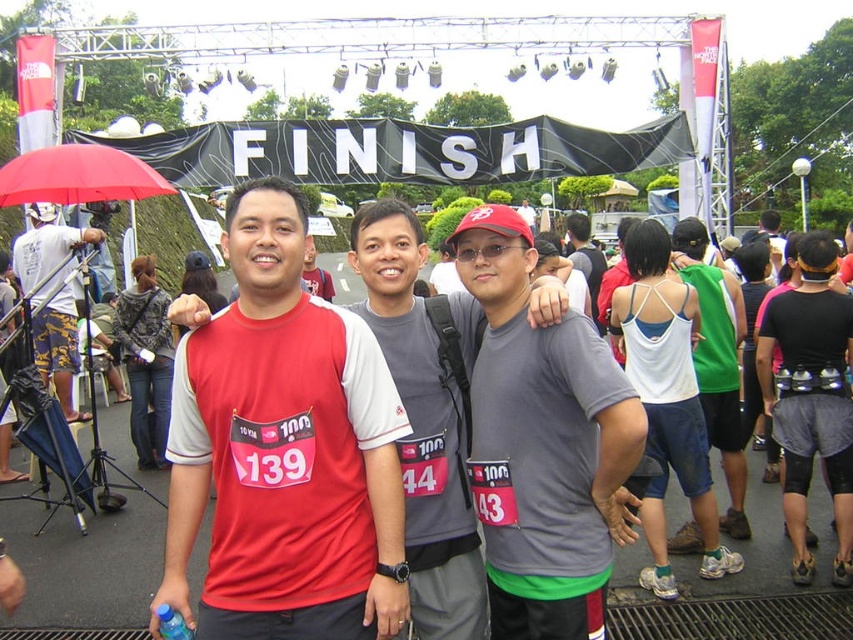
Question: Which point is farther to the camera?

Choices:
 (A) white cotton tank top at center
 (B) gray matte t-shirt at center
 (C) matte red t-shirt at center
 (D) white fabric umbrella at left

Answer: (D)

Question: Which point is farther to the camera?

Choices:
 (A) white fabric umbrella at left
 (B) gray matte t-shirt at center
 (C) matte gray t-shirt at center
 (D) matte red t-shirt at center

Answer: (C)

Question: Can you confirm if matte red t-shirt at center is thinner than white cotton tank top at center?

Choices:
 (A) no
 (B) yes

Answer: (A)

Question: Does matte red t-shirt at center appear on the right side of gray matte t-shirt at center?

Choices:
 (A) no
 (B) yes

Answer: (A)

Question: Does matte red t-shirt at center appear on the right side of matte gray t-shirt at center?

Choices:
 (A) no
 (B) yes

Answer: (A)

Question: Which object is the closest to the matte gray t-shirt at center?

Choices:
 (A) white cotton tank top at center
 (B) matte red t-shirt at center
 (C) white fabric umbrella at left

Answer: (A)